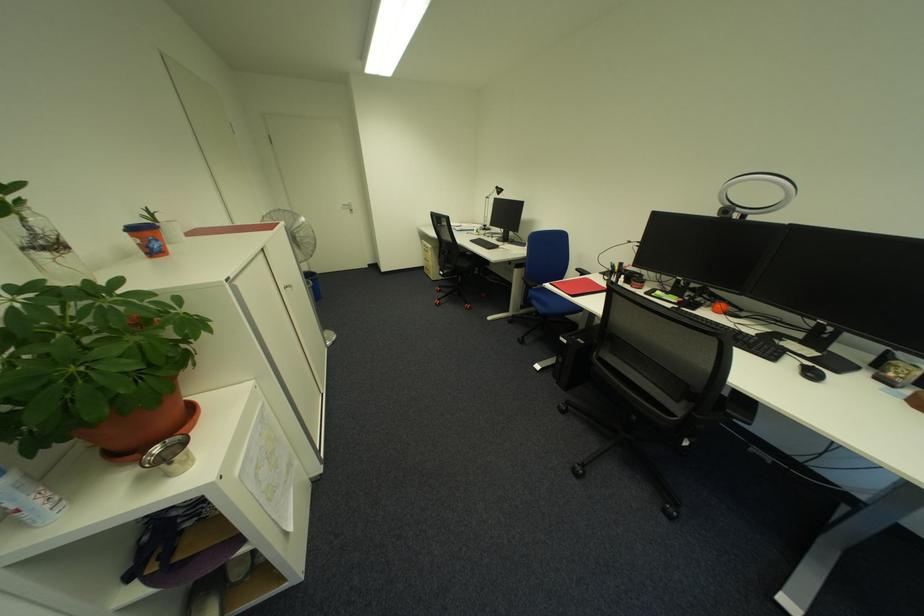
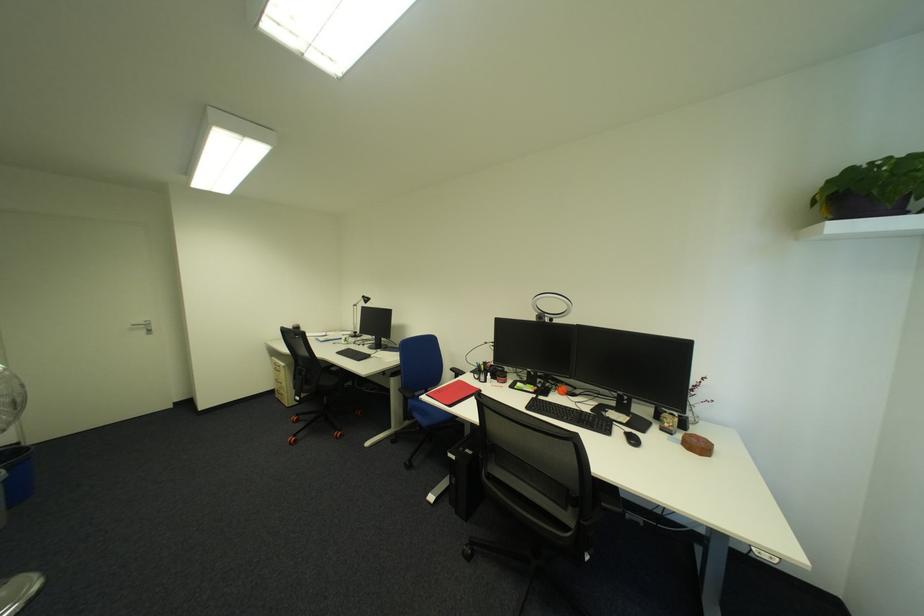
Locate, in the second image, the point that corresponds to pixel 541 306 in the first image.

(424, 419)